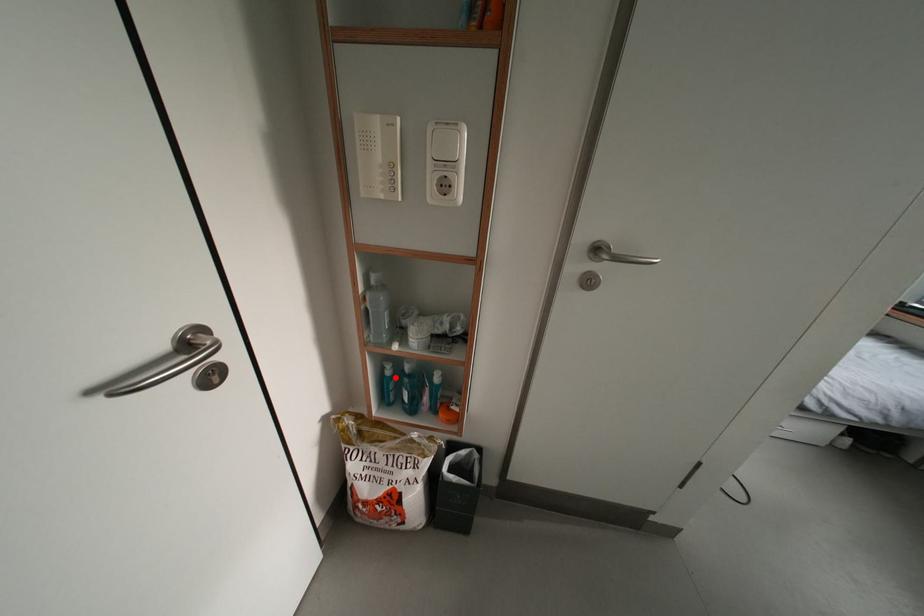
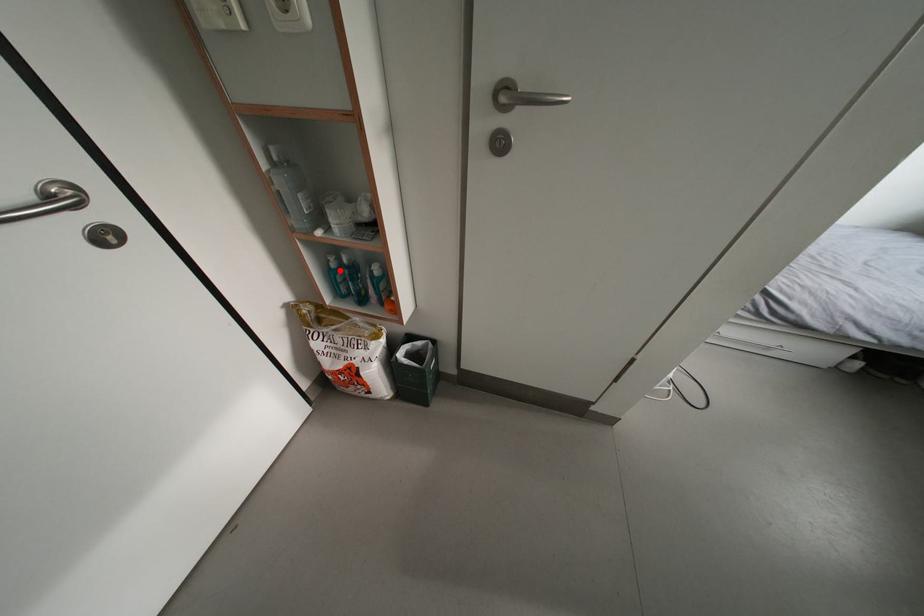
I am providing you with two images of the same scene from different viewpoints. A red point is marked on the first image and another point is marked on the second image. Does the point marked in image1 correspond to the same location as the one in image2?

Yes